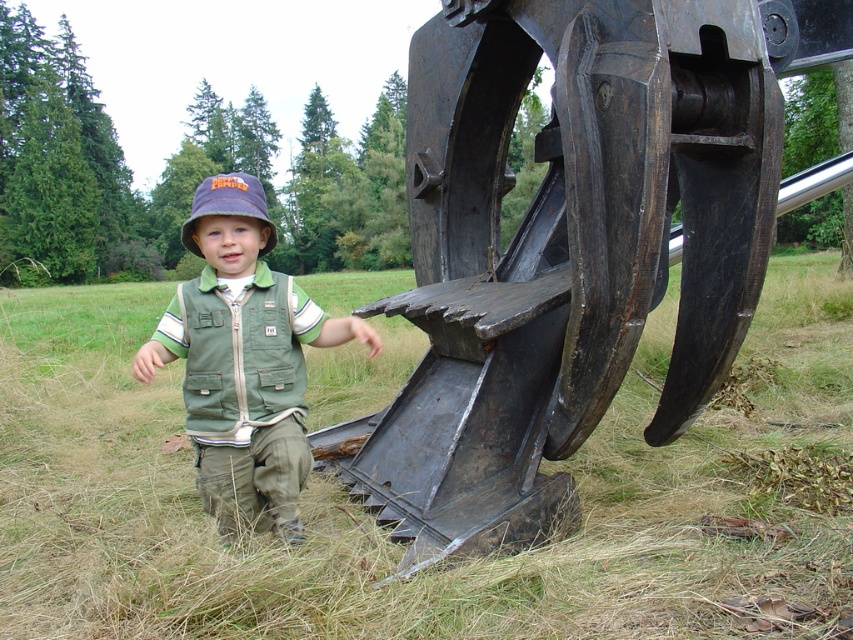
The child is wearing two items at the center of the image. Which one is smaller in size between the green fabric vest at center and the purple fabric bucket hat at center?

The green fabric vest at center has a smaller size compared to the purple fabric bucket hat at center.

You are a photographer trying to capture the child wearing the green fabric vest at center and the purple fabric bucket hat at center. If you want to focus on the vest first, which object should you adjust your camera to prioritize?

The green fabric vest at center is in front of the purple fabric bucket hat at center, so you should prioritize focusing on the green fabric vest at center first.

Based on the photo, you are a gardener who needs to mow the lawn. You see the green grass at lower left and the purple fabric bucket hat at center. Which area should you mow first if you want to start from the tallest grass?

The green grass at lower left should be mowed first because it is much taller than the purple fabric bucket hat at center.